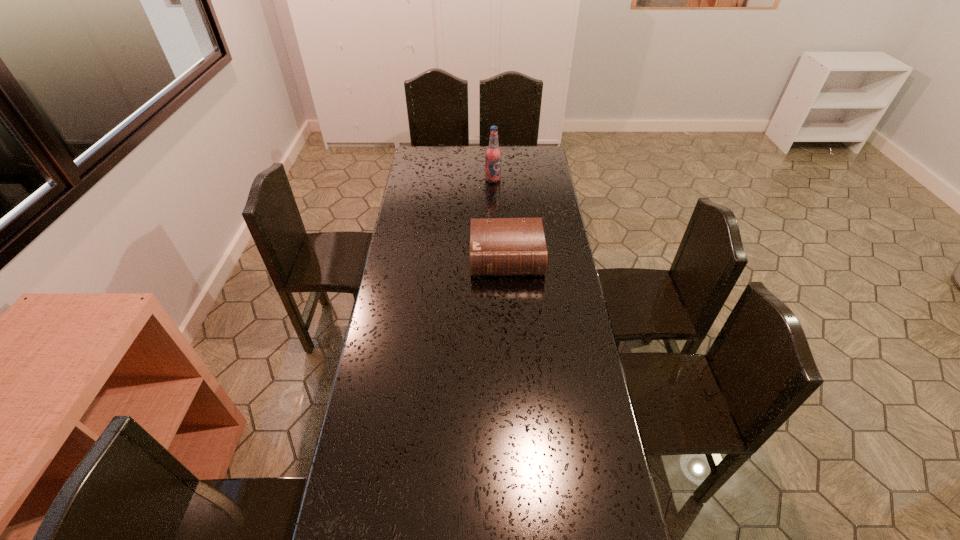
Where is `the farther object`? The image size is (960, 540). the farther object is located at coordinates (493, 154).

Find the location of a particular element. The width and height of the screenshot is (960, 540). the taller object is located at coordinates (493, 154).

The height and width of the screenshot is (540, 960). Identify the location of Bible. (498, 246).

The width and height of the screenshot is (960, 540). What are the coordinates of `the shorter object` in the screenshot? It's located at (498, 246).

This screenshot has height=540, width=960. Find the location of `free spot located 0.130m on the right of the taller object`. free spot located 0.130m on the right of the taller object is located at coordinates (527, 179).

Where is `blank space located 0.390m on the spine side of the Bible`? This screenshot has width=960, height=540. blank space located 0.390m on the spine side of the Bible is located at coordinates (514, 364).

Where is `object at the right edge`? The width and height of the screenshot is (960, 540). object at the right edge is located at coordinates (498, 246).

At what (x,y) coordinates should I click in order to perform the action: click on blank space at the far edge of the desktop. Please return your answer as a coordinate pair (x, y). Looking at the image, I should click on (453, 162).

Where is `free space at the left edge of the desktop`? Image resolution: width=960 pixels, height=540 pixels. free space at the left edge of the desktop is located at coordinates (396, 410).

The image size is (960, 540). In order to click on free location at the right edge of the desktop in this screenshot , I will do `click(557, 289)`.